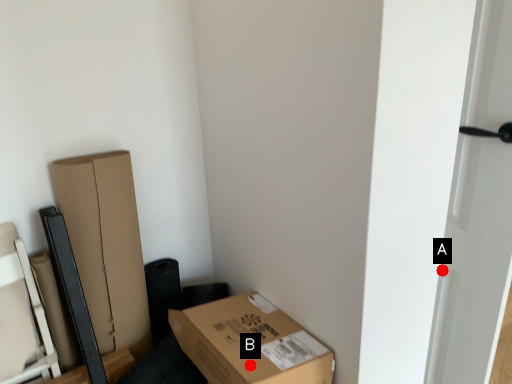
Question: Two points are circled on the image, labeled by A and B beside each circle. Among these points, which one is farthest from the camera?

Choices:
 (A) A is further
 (B) B is further

Answer: (A)